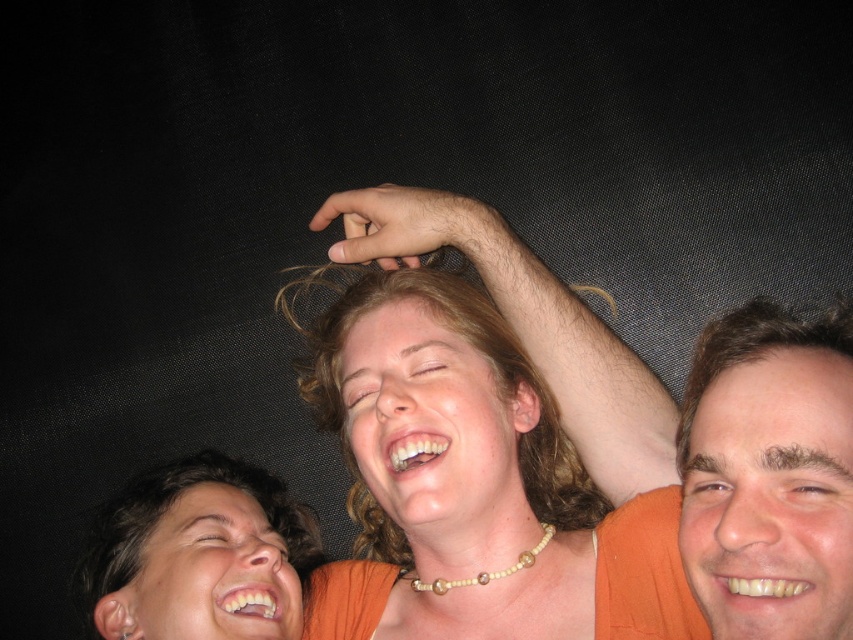
Question: Can you confirm if orange fabric shirt at center is wider than smooth skin face at upper right?

Choices:
 (A) yes
 (B) no

Answer: (A)

Question: Which point is closer to the camera?

Choices:
 (A) smooth skin face at upper right
 (B) orange fabric shirt at center

Answer: (A)

Question: Does orange fabric shirt at center have a smaller size compared to smooth skin face at upper right?

Choices:
 (A) yes
 (B) no

Answer: (B)

Question: Which point appears farthest from the camera in this image?

Choices:
 (A) (850, 320)
 (B) (485, 307)

Answer: (B)

Question: Can you confirm if orange fabric shirt at center is bigger than smooth skin face at upper right?

Choices:
 (A) no
 (B) yes

Answer: (B)